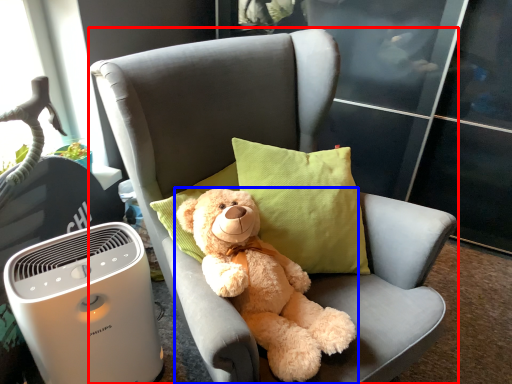
Question: Among these objects, which one is farthest to the camera, chair (highlighted by a red box) or teddy bear (highlighted by a blue box)?

Choices:
 (A) chair
 (B) teddy bear

Answer: (B)